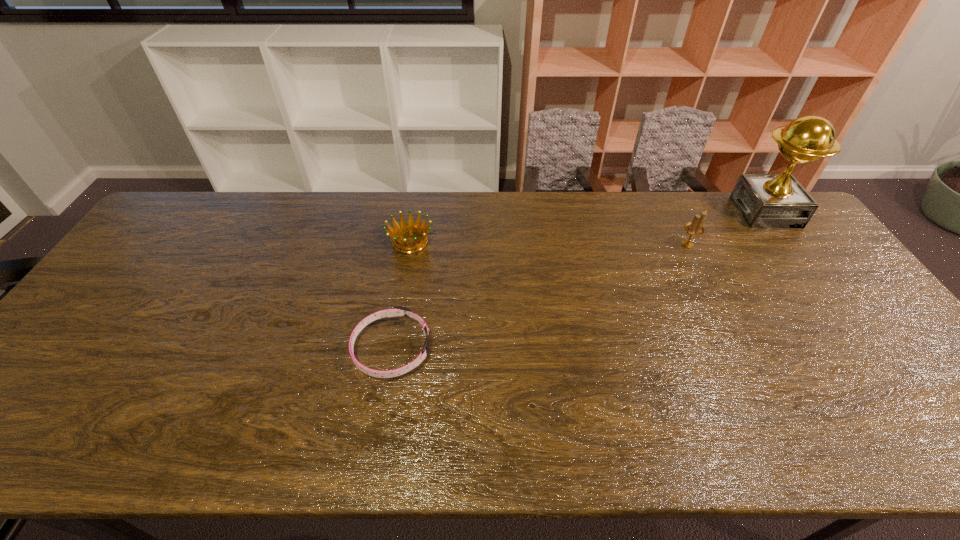
In the image, there is a desktop. Where is `vacant space at the far left corner`? vacant space at the far left corner is located at coordinates (211, 207).

At what (x,y) coordinates should I click in order to perform the action: click on free space at the far right corner of the desktop. Please return your answer as a coordinate pair (x, y). This screenshot has height=540, width=960. Looking at the image, I should click on (803, 231).

The height and width of the screenshot is (540, 960). What are the coordinates of `unoccupied position between the crown and the tallest object` in the screenshot? It's located at (588, 227).

Find the location of `free space that is in between the third shortest object and the crown`. free space that is in between the third shortest object and the crown is located at coordinates (549, 243).

The image size is (960, 540). I want to click on vacant space that is in between the crown and the award, so click(588, 227).

Locate an element on the screen. The height and width of the screenshot is (540, 960). free space between the second shortest object and the nearest object is located at coordinates (401, 295).

This screenshot has height=540, width=960. Find the location of `vacant space that is in between the tallest object and the second object from right to left`. vacant space that is in between the tallest object and the second object from right to left is located at coordinates (727, 228).

The width and height of the screenshot is (960, 540). Identify the location of vacant space in between the tallest object and the third tallest object. (588, 227).

This screenshot has width=960, height=540. What are the coordinates of `vacant space in between the crown and the nearest object` in the screenshot? It's located at (401, 295).

Locate an element on the screen. This screenshot has width=960, height=540. free spot between the tallest object and the nearest object is located at coordinates (x=579, y=280).